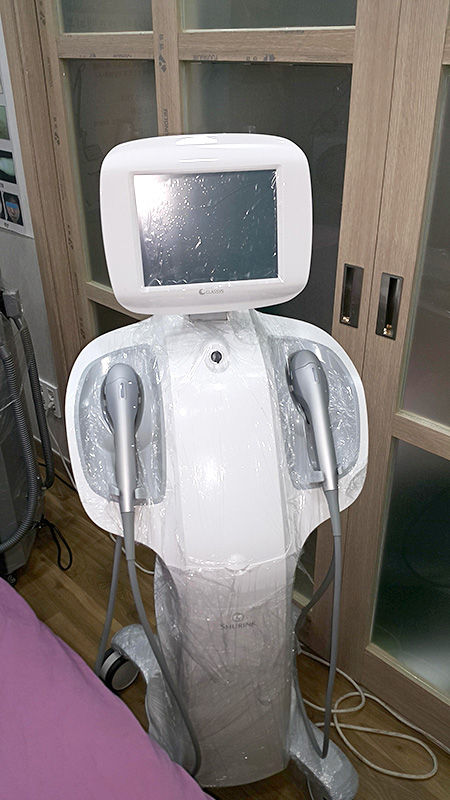
This screenshot has height=800, width=450. In order to click on pink bed-sheet in this screenshot , I will do `click(41, 674)`.